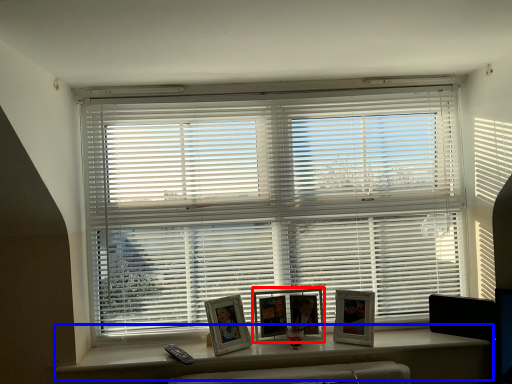
Question: Which of the following is the closest to the observer, picture frame (highlighted by a red box) or window (highlighted by a blue box)?

Choices:
 (A) picture frame
 (B) window

Answer: (B)